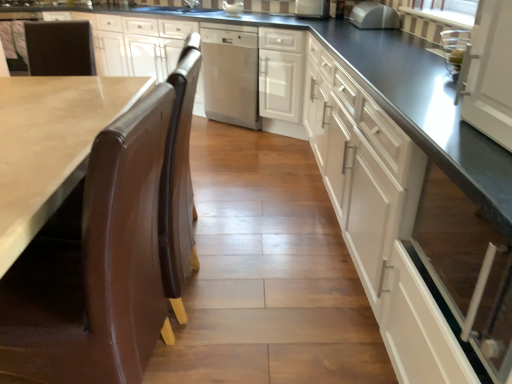
Question: Is brown polished wood countertop at lower left in front of or behind white glossy gravy boat at center, the third appliance from the right, in the image?

Choices:
 (A) behind
 (B) front

Answer: (B)

Question: Is brown polished wood countertop at lower left to the left or to the right of white glossy gravy boat at center, positioned as the first appliance in left-to-right order, in the image?

Choices:
 (A) left
 (B) right

Answer: (A)

Question: Which is farther from the satin silver microwave at upper center, the 1th appliance from the front?

Choices:
 (A) satin white refrigerator at upper center, the second appliance viewed from the front
 (B) white striped fabric at upper right
 (C) stainless steel dishwasher at center
 (D) white glossy cabinet at right, the 2th cabinetry in the back-to-front sequence
 (E) white glossy cabinet at center, which ranks as the 2th cabinetry in front-to-back order

Answer: (D)

Question: Which is farther from the brown leather chair at left?

Choices:
 (A) white glossy cabinet at right, which appears as the first cabinetry when viewed from the front
 (B) stainless steel dishwasher at center
 (C) satin silver microwave at upper center, the 1th appliance from the front
 (D) white striped fabric at upper right
 (E) white glossy cabinet at center, which is counted as the first cabinetry, starting from the back

Answer: (D)